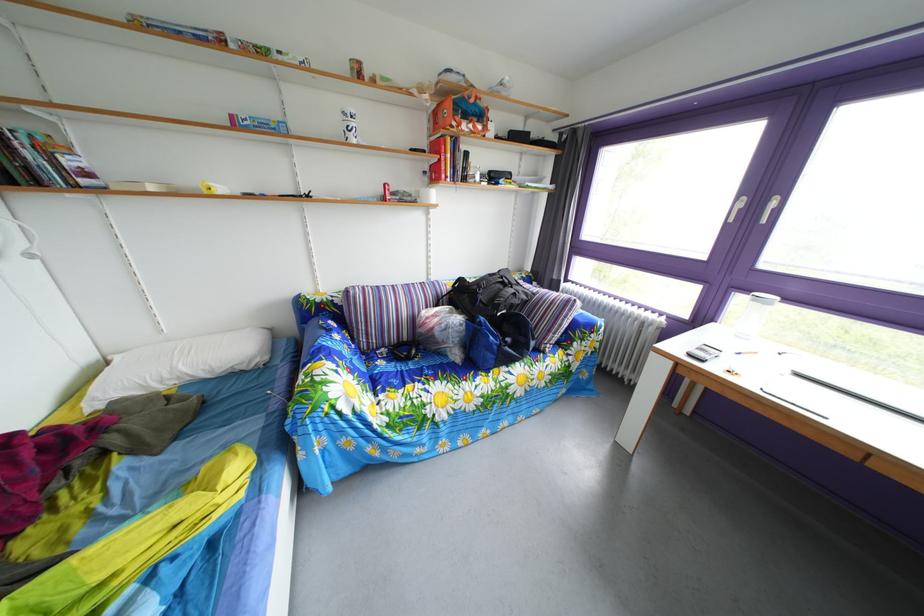
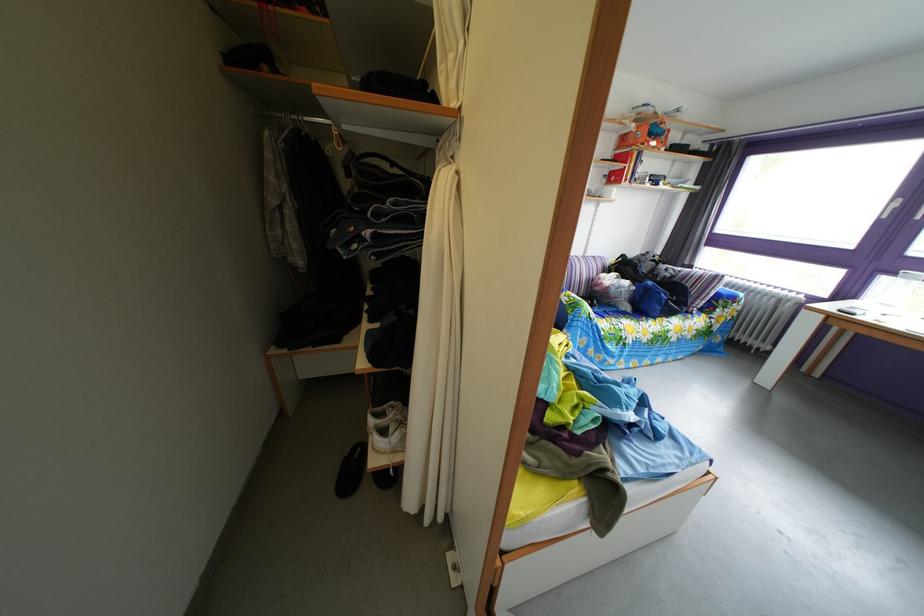
In the second image, find the point that corresponds to [476,124] in the first image.

(661, 144)